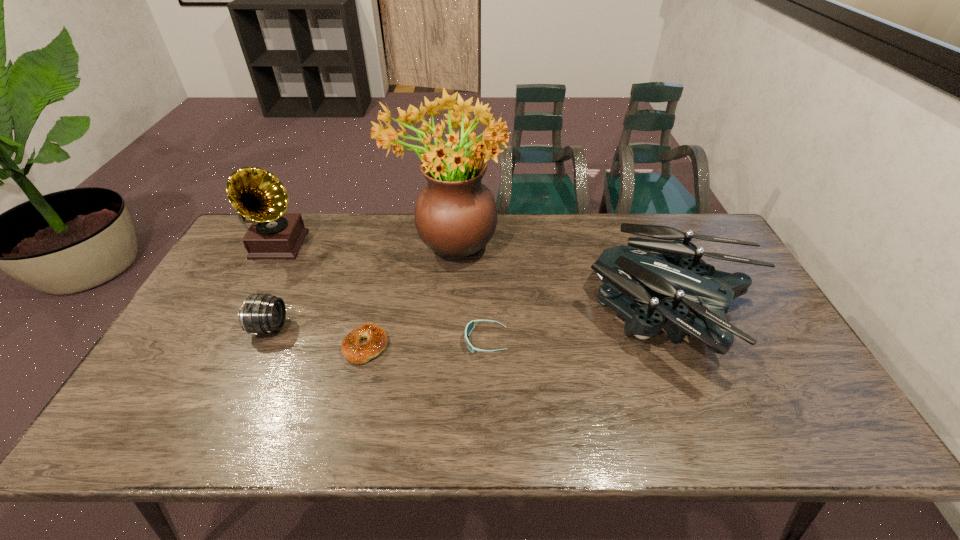
Locate an element on the screen. The height and width of the screenshot is (540, 960). vacant space in between the goggles and the third tallest object is located at coordinates (580, 329).

Identify the location of unoccupied position between the bagel and the fourth tallest object. The height and width of the screenshot is (540, 960). (318, 336).

Locate an element on the screen. empty location between the phonograph record and the goggles is located at coordinates (382, 293).

Where is `free space that is in between the fifth shortest object and the goggles`? free space that is in between the fifth shortest object and the goggles is located at coordinates (382, 293).

Identify the location of free spot between the second tallest object and the drone. The width and height of the screenshot is (960, 540). (476, 281).

Locate an element on the screen. Image resolution: width=960 pixels, height=540 pixels. the fifth closest object to the phonograph record is located at coordinates (673, 271).

At what (x,y) coordinates should I click in order to perform the action: click on object that stands as the fifth closest to the third shortest object. Please return your answer as a coordinate pair (x, y). The width and height of the screenshot is (960, 540). Looking at the image, I should click on (673, 271).

Find the location of a particular element. This screenshot has width=960, height=540. vacant space that satisfies the following two spatial constraints: 1. from the horn of the second tallest object; 2. on the right side of the flower arrangement is located at coordinates (277, 245).

Locate an element on the screen. The width and height of the screenshot is (960, 540). free space that satisfies the following two spatial constraints: 1. from the horn of the second tallest object; 2. on the left side of the bagel is located at coordinates (224, 346).

In order to click on free location that satisfies the following two spatial constraints: 1. on the front-facing side of the goggles; 2. on the front side of the bagel in this screenshot , I will do `click(486, 346)`.